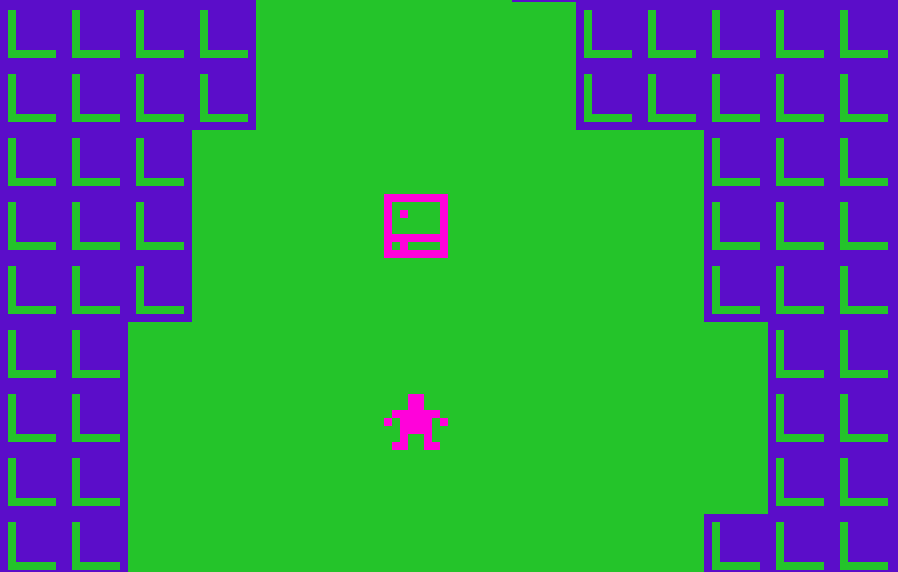
The width and height of the screenshot is (898, 572). I want to click on walls, so click(735, 224), click(155, 218).